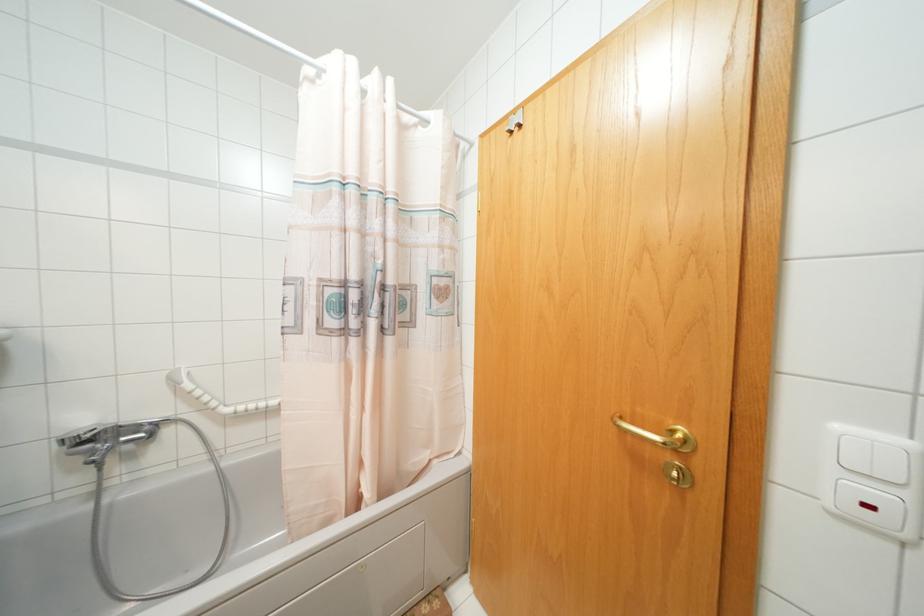
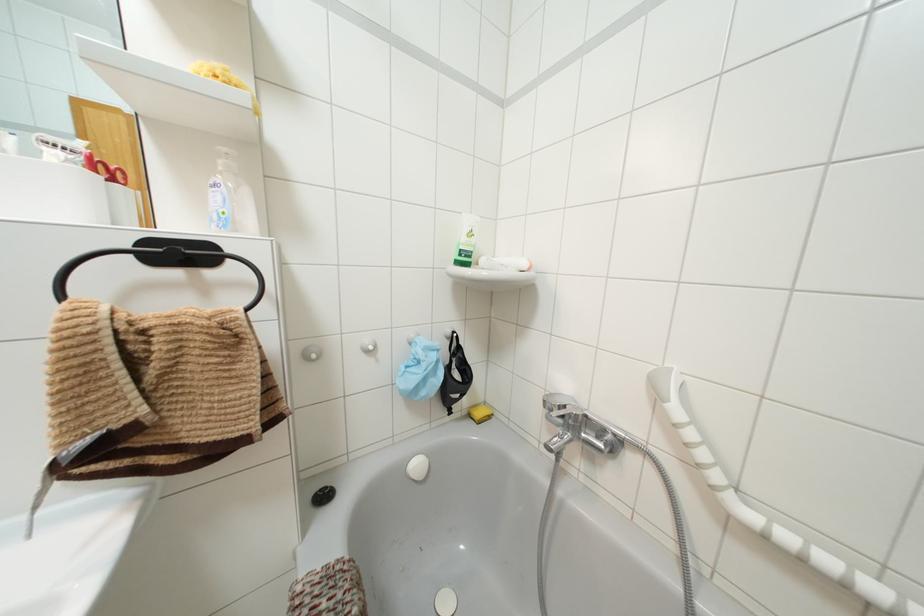
Question: The images are taken continuously from a first-person perspective. In which direction is your viewpoint rotating?

Choices:
 (A) Left
 (B) Right
 (C) Up
 (D) Down

Answer: (A)